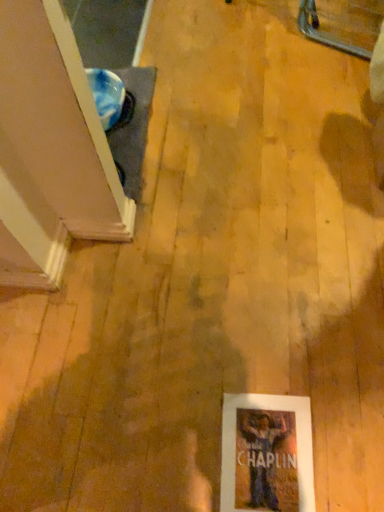
This screenshot has height=512, width=384. I want to click on vacant region to the left of white paper poster at lower center, so click(x=170, y=445).